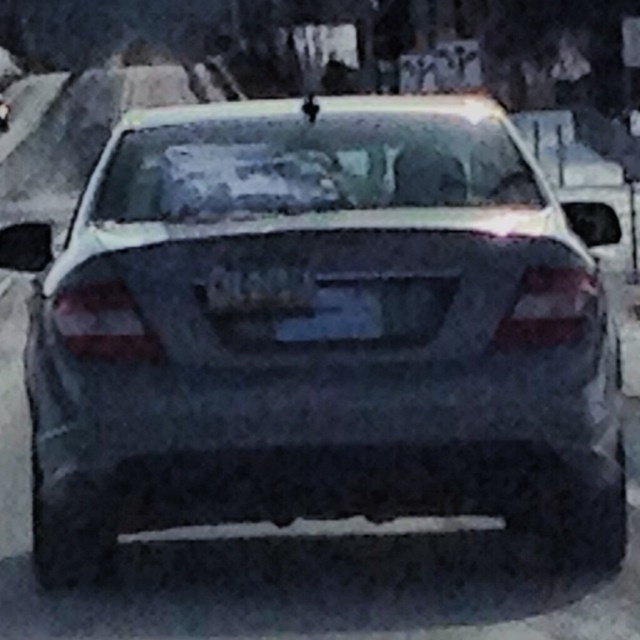
Question: Where is black plastic license plate at center located in relation to satin black sedan at center in the image?

Choices:
 (A) below
 (B) above

Answer: (A)

Question: Does black plastic license plate at center appear over satin black sedan at center?

Choices:
 (A) yes
 (B) no

Answer: (B)

Question: Does black plastic license plate at center have a smaller size compared to satin black sedan at center?

Choices:
 (A) yes
 (B) no

Answer: (A)

Question: Which of the following is the closest to the observer?

Choices:
 (A) black plastic license plate at center
 (B) satin black sedan at center

Answer: (A)

Question: Which object appears closest to the camera in this image?

Choices:
 (A) satin black sedan at center
 (B) black plastic license plate at center

Answer: (B)